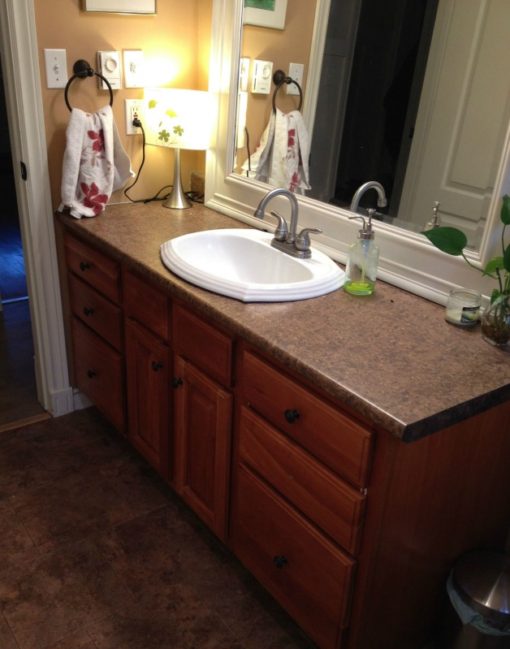
The height and width of the screenshot is (649, 510). I want to click on sink, so click(x=248, y=276).